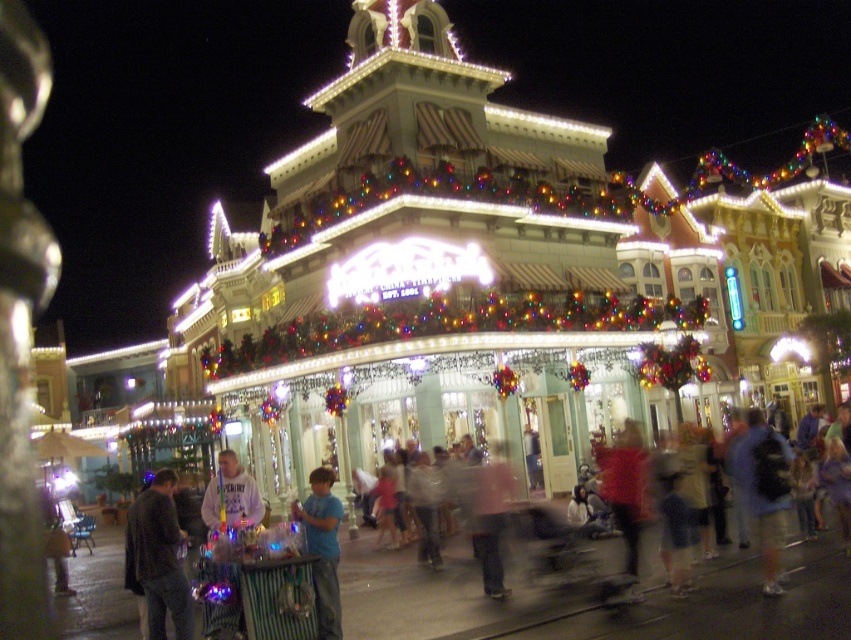
Question: Which object appears closest to the camera in this image?

Choices:
 (A) blue cotton shirt at center
 (B) blue backpack at lower right

Answer: (A)

Question: Can you confirm if dark gray sweater at lower left is positioned above blue cotton shirt at center?

Choices:
 (A) yes
 (B) no

Answer: (B)

Question: Does dark gray sweater at lower left appear on the left side of blue cotton shirt at center?

Choices:
 (A) yes
 (B) no

Answer: (A)

Question: Among these points, which one is nearest to the camera?

Choices:
 (A) (320, 561)
 (B) (475, 504)
 (C) (768, 458)

Answer: (A)

Question: Which object is the farthest from the dark gray sweater at lower left?

Choices:
 (A) blue cotton shirt at center
 (B) blue backpack at lower right
 (C) pink fabric at center

Answer: (B)

Question: Considering the relative positions of blue cotton shirt at center and pink fabric at center in the image provided, where is blue cotton shirt at center located with respect to pink fabric at center?

Choices:
 (A) right
 (B) left

Answer: (B)